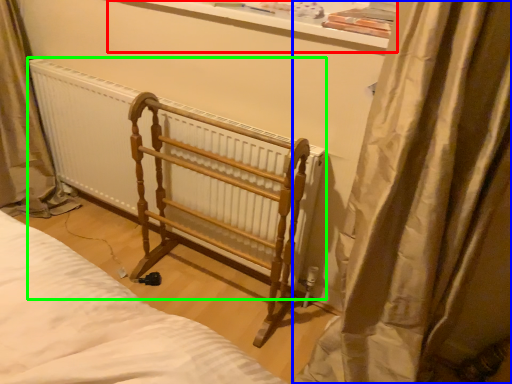
Question: Based on their relative distances, which object is nearer to window sill (highlighted by a red box)? Choose from curtain (highlighted by a blue box) and radiator (highlighted by a green box).

Choices:
 (A) curtain
 (B) radiator

Answer: (A)